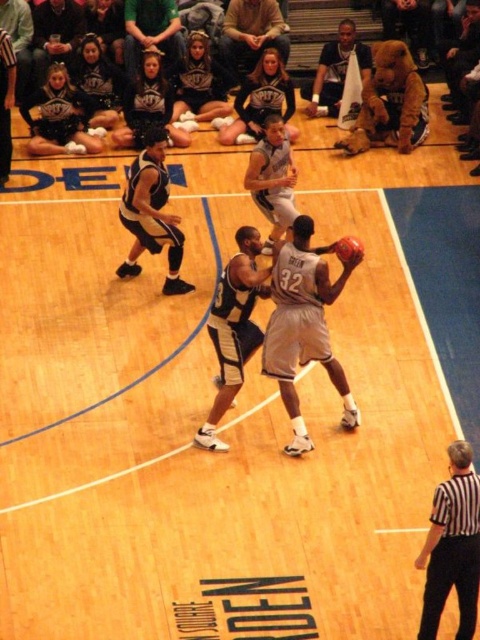
Question: Can you confirm if white matte basketball player at center is positioned below glossy orange basketball at center?

Choices:
 (A) no
 (B) yes

Answer: (B)

Question: Estimate the real-world distances between objects in this image. Which object is farther from the white matte basketball player at center?

Choices:
 (A) matte black basketball at center
 (B) green jersey at upper center

Answer: (B)

Question: Is dark blue jersey at center thinner than green jersey at upper center?

Choices:
 (A) no
 (B) yes

Answer: (B)

Question: Which point is closer to the camera?

Choices:
 (A) coord(252,20)
 (B) coord(8,112)

Answer: (B)

Question: Which object is positioned farthest from the dark blue jersey at left?

Choices:
 (A) matte gray jersey at center
 (B) green jersey at upper center

Answer: (A)

Question: Does green jersey at upper center appear on the right side of matte black basketball at center?

Choices:
 (A) no
 (B) yes

Answer: (B)